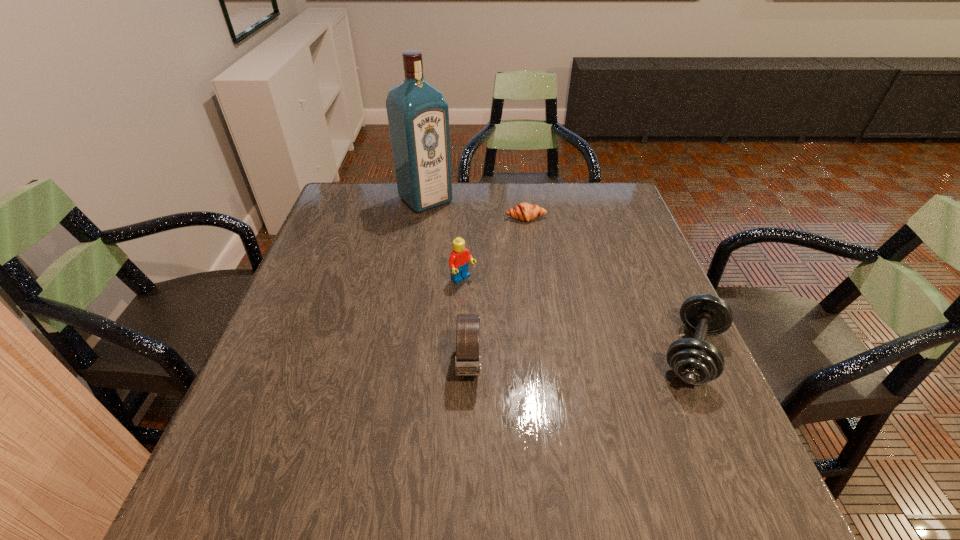
Where is `vacant area between the leftmost object and the Lego`? The height and width of the screenshot is (540, 960). vacant area between the leftmost object and the Lego is located at coordinates (444, 240).

Identify the location of blank region between the leftmost object and the fourth object from left to right. (476, 208).

This screenshot has width=960, height=540. Identify the location of vacant space that is in between the second object from right to left and the tallest object. (476, 208).

Find the location of a particular element. This screenshot has height=540, width=960. free space between the watch and the tallest object is located at coordinates (447, 282).

Find the location of `object that is the fourth closest to the fourth tallest object`. object that is the fourth closest to the fourth tallest object is located at coordinates (418, 115).

Find the location of a particular element. object that is the third closest one to the watch is located at coordinates (524, 211).

Image resolution: width=960 pixels, height=540 pixels. What are the coordinates of `free space that satisfies the following two spatial constraints: 1. on the front side of the rightmost object; 2. on the right side of the liquor` in the screenshot? It's located at (399, 353).

This screenshot has height=540, width=960. In order to click on free space that satisfies the following two spatial constraints: 1. on the front side of the pastry; 2. on the left side of the fourth tallest object in this screenshot , I will do tap(544, 353).